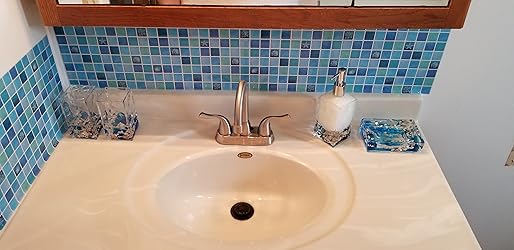
Where is `bathroom counter`? The height and width of the screenshot is (250, 514). bathroom counter is located at coordinates (380, 181).